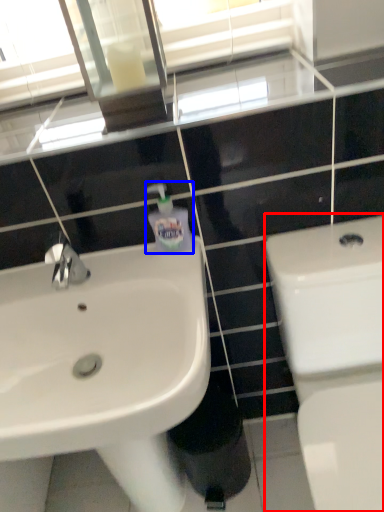
Question: Which point is closer to the camera, toilet (highlighted by a red box) or soap dispenser (highlighted by a blue box)?

Choices:
 (A) toilet
 (B) soap dispenser

Answer: (A)